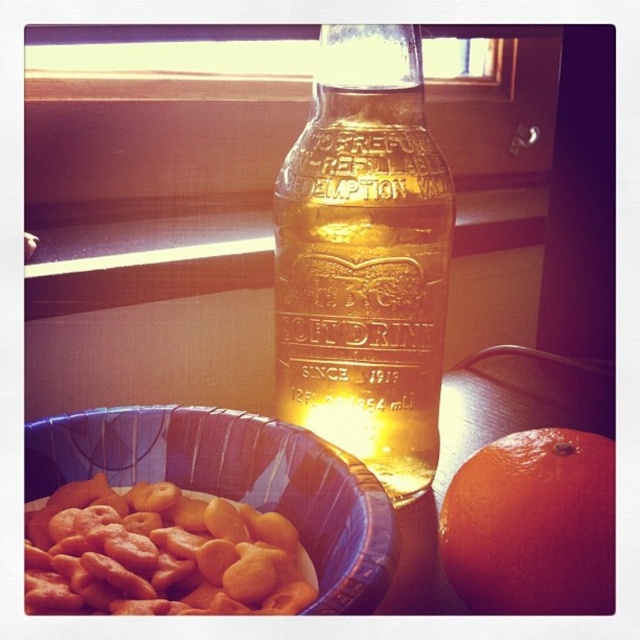
Question: Does golden crispy cereal at lower left appear over orange matte at right?

Choices:
 (A) yes
 (B) no

Answer: (B)

Question: Which of the following is the farthest from the observer?

Choices:
 (A) golden crispy cereal at lower left
 (B) orange matte at right
 (C) translucent glass bottle at center

Answer: (C)

Question: Observing the image, what is the correct spatial positioning of golden crispy cereal at lower left in reference to orange matte at right?

Choices:
 (A) below
 (B) above

Answer: (A)

Question: Which point is farther from the camera taking this photo?

Choices:
 (A) (336, 320)
 (B) (534, 440)
 (C) (76, 522)

Answer: (A)

Question: Is translucent glass bottle at center positioned before orange matte at right?

Choices:
 (A) yes
 (B) no

Answer: (B)

Question: Among these objects, which one is nearest to the camera?

Choices:
 (A) orange matte at right
 (B) translucent glass bottle at center

Answer: (A)